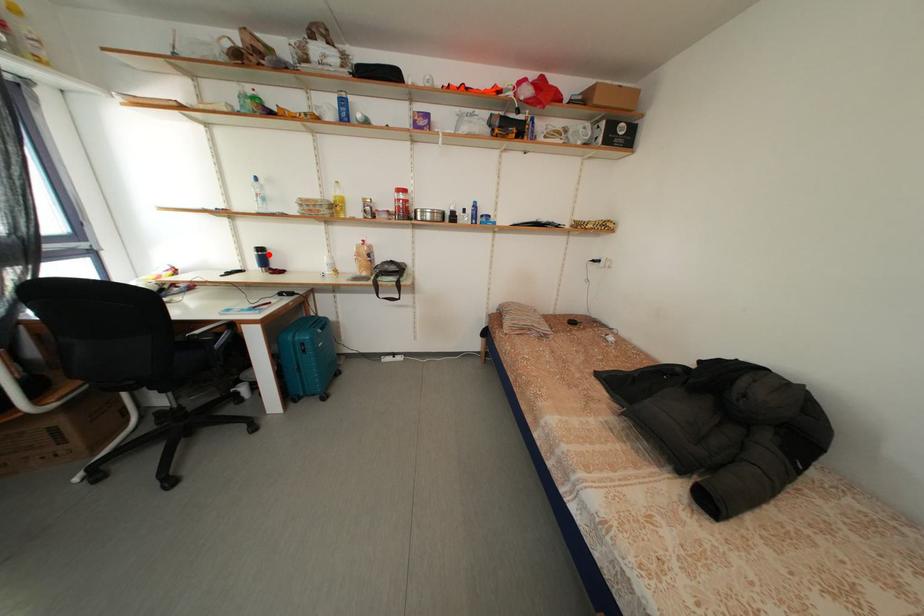
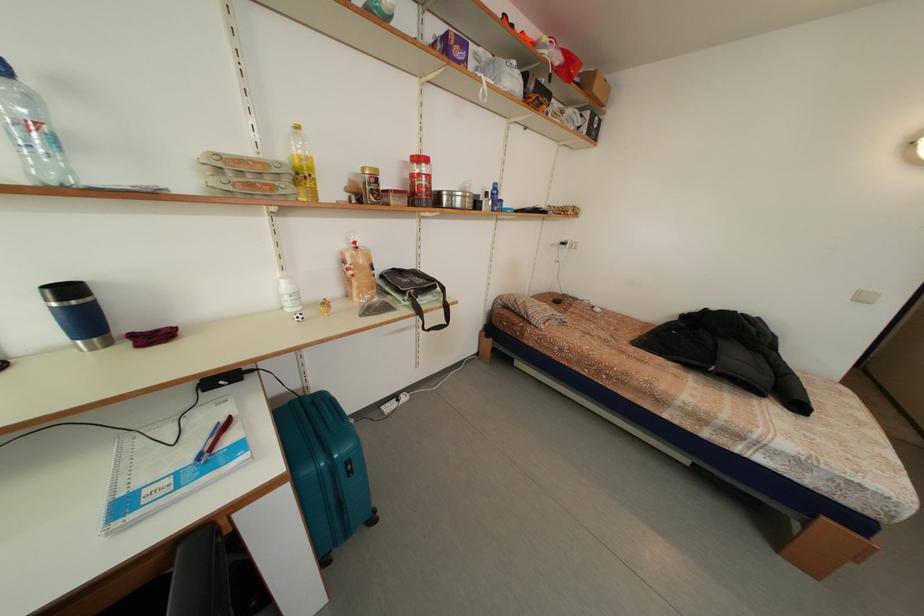
In the second image, find the point that corresponds to the highlighted location in the first image.

(78, 296)